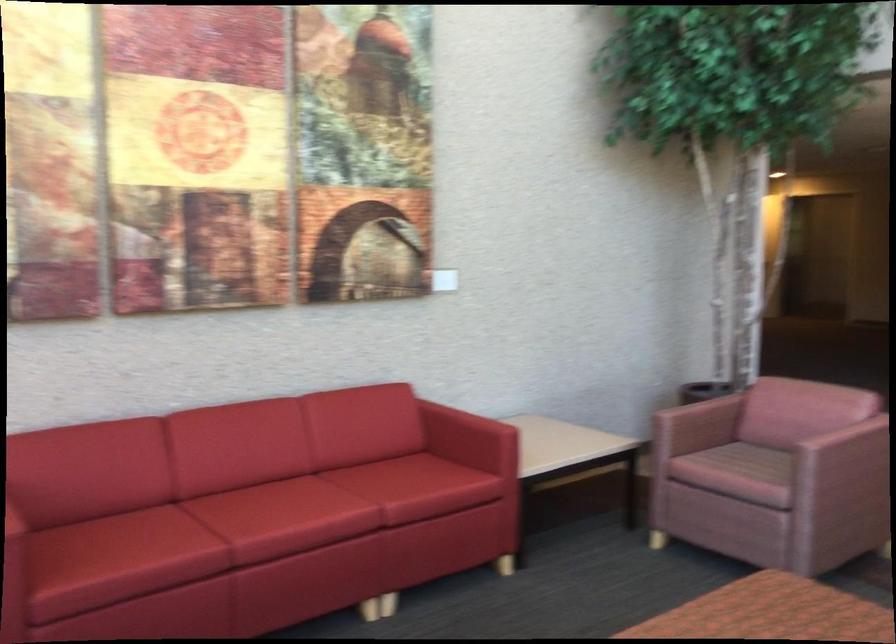
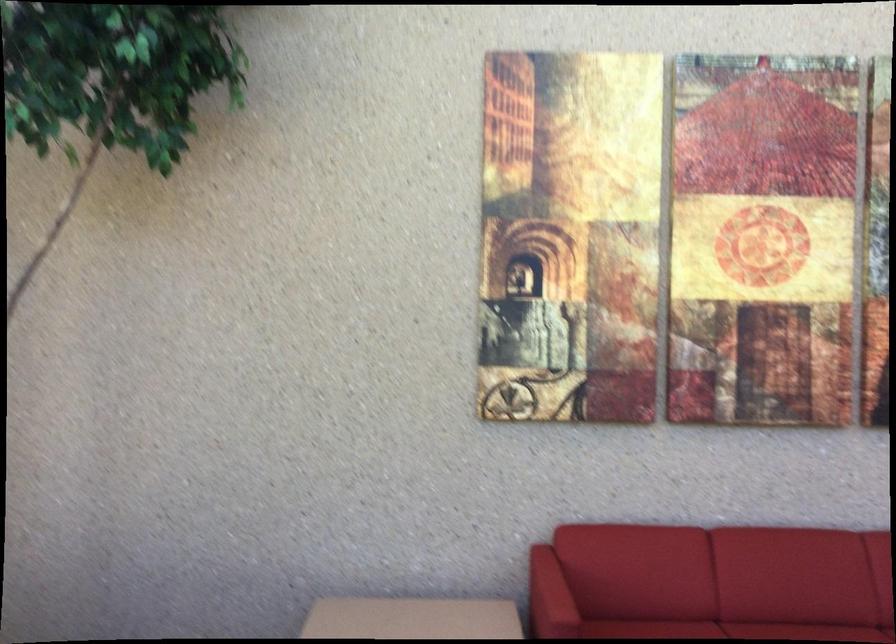
The point at (x=186, y=511) is marked in the first image. Where is the corresponding point in the second image?

(727, 630)